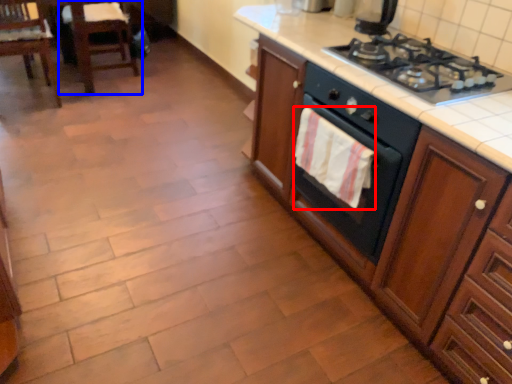
Question: Which object appears farthest to the camera in this image, hand towel (highlighted by a red box) or chair (highlighted by a blue box)?

Choices:
 (A) hand towel
 (B) chair

Answer: (B)